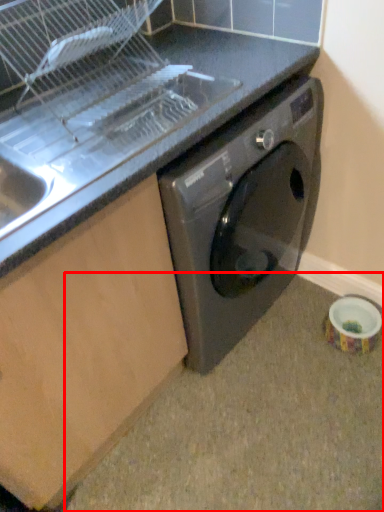
Question: From the image's perspective, considering the relative positions of granite (annotated by the red box) and counter top in the image provided, where is granite (annotated by the red box) located with respect to the staircase?

Choices:
 (A) above
 (B) below

Answer: (B)